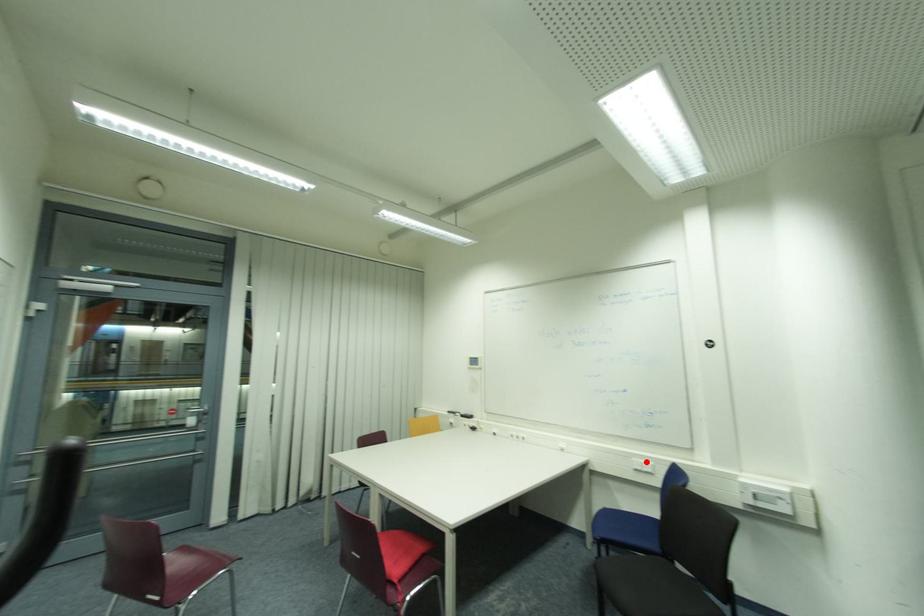
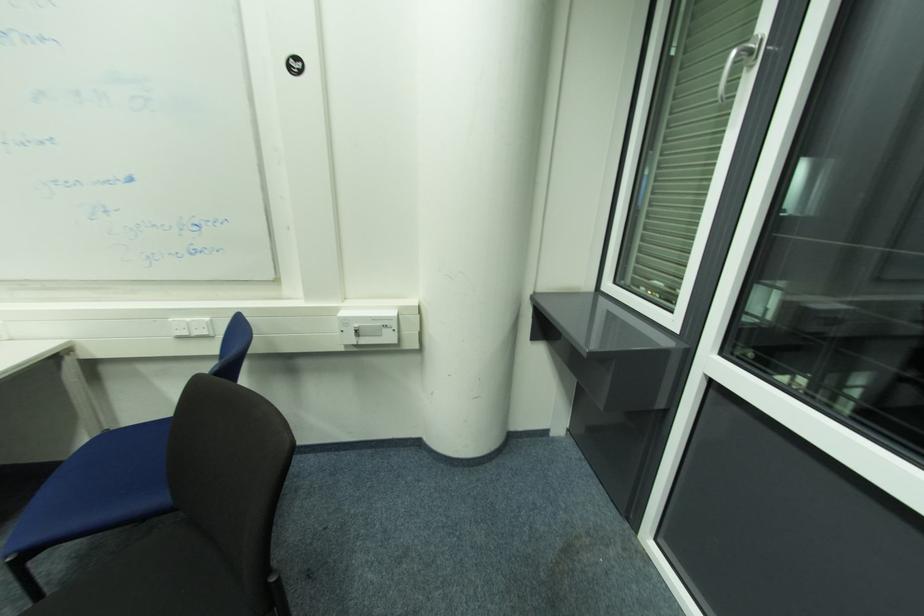
Question: I am providing you with two images of the same scene from different viewpoints. A red point is marked on the first image. Can you still see the location of the red point in image 2?

Choices:
 (A) Yes
 (B) No

Answer: (A)